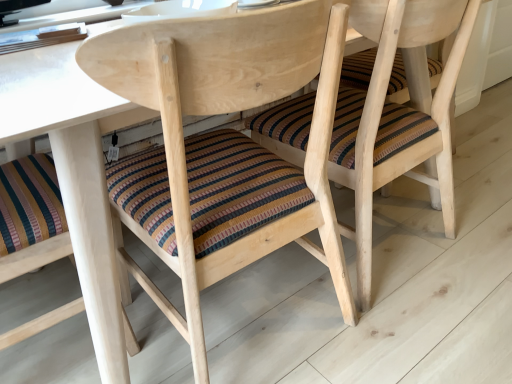
Question: Is striped fabric cushion at center, which ranks as the second chair in right-to-left order, situated inside striped fabric cushion at center, placed as the 1th chair when sorted from right to left, or outside?

Choices:
 (A) outside
 (B) inside

Answer: (A)

Question: Relative to striped fabric cushion at center, the 2th chair in the left-to-right sequence, is striped fabric cushion at center, marked as the first chair in a left-to-right arrangement, in front or behind?

Choices:
 (A) behind
 (B) front

Answer: (B)

Question: Based on their positions, is striped fabric cushion at center, marked as the first chair in a left-to-right arrangement, located to the left or right of striped fabric cushion at center, placed as the 1th chair when sorted from right to left?

Choices:
 (A) right
 (B) left

Answer: (B)

Question: From a real-world perspective, is striped fabric cushion at center, placed as the 1th chair when sorted from right to left, physically located above or below striped fabric cushion at center, which ranks as the second chair in right-to-left order?

Choices:
 (A) below
 (B) above

Answer: (A)

Question: Looking at their shapes, would you say striped fabric cushion at center, the 2th chair in the left-to-right sequence, is wider or thinner than striped fabric cushion at center, marked as the first chair in a left-to-right arrangement?

Choices:
 (A) wide
 (B) thin

Answer: (B)

Question: Considering the positions of striped fabric cushion at center, placed as the 1th chair when sorted from right to left, and striped fabric cushion at center, which ranks as the second chair in right-to-left order, in the image, is striped fabric cushion at center, placed as the 1th chair when sorted from right to left, taller or shorter than striped fabric cushion at center, which ranks as the second chair in right-to-left order,?

Choices:
 (A) tall
 (B) short

Answer: (B)

Question: Is striped fabric cushion at center, the 2th chair in the left-to-right sequence, in front of or behind striped fabric cushion at center, marked as the first chair in a left-to-right arrangement, in the image?

Choices:
 (A) behind
 (B) front

Answer: (A)